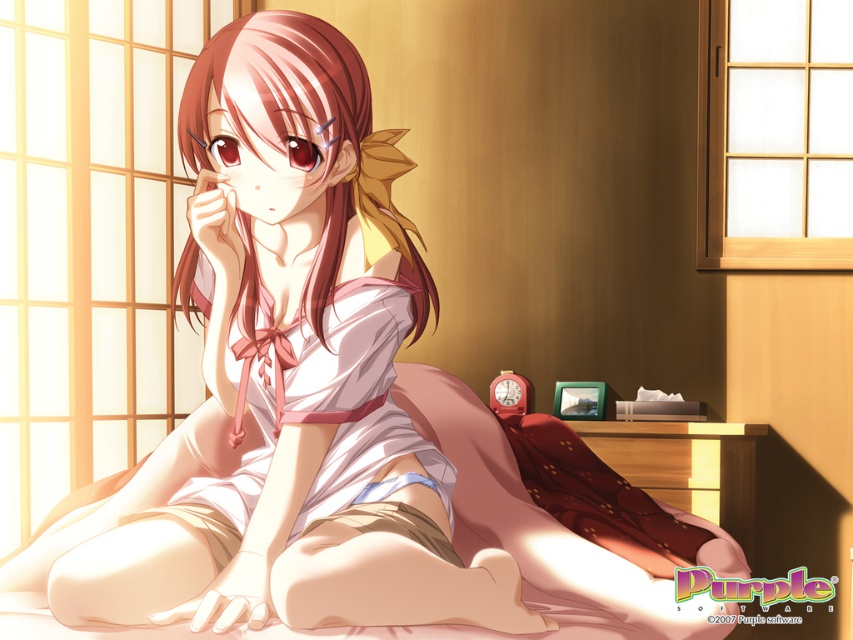
Which is above, smooth white dress at center or soft pink fabric bed at lower center?

smooth white dress at center is above.

Between smooth white dress at center and soft pink fabric bed at lower center, which one has more height?

smooth white dress at center is taller.

Between point (300, 387) and point (473, 628), which one is positioned behind?

Point (473, 628)

This screenshot has height=640, width=853. Identify the location of smooth white dress at center. (286, 380).